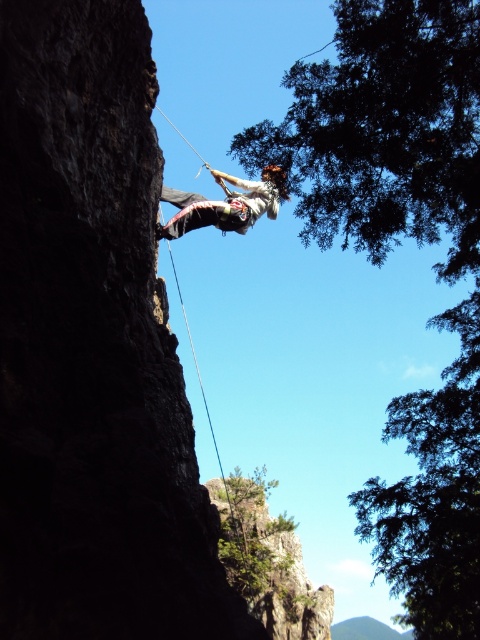
Question: Can you confirm if green leafy tree at upper right is thinner than white climbing harness at center?

Choices:
 (A) yes
 (B) no

Answer: (B)

Question: Which object is closer to the camera taking this photo?

Choices:
 (A) green leafy tree at upper right
 (B) white climbing harness at center

Answer: (A)

Question: Is green leafy tree at upper right thinner than white climbing harness at center?

Choices:
 (A) no
 (B) yes

Answer: (A)

Question: Observing the image, what is the correct spatial positioning of green leafy tree at upper right in reference to white climbing harness at center?

Choices:
 (A) above
 (B) below

Answer: (B)

Question: Which point is farther to the camera?

Choices:
 (A) (375, 532)
 (B) (181, 202)

Answer: (B)

Question: Among these objects, which one is nearest to the camera?

Choices:
 (A) green leafy tree at upper right
 (B) white climbing harness at center

Answer: (A)